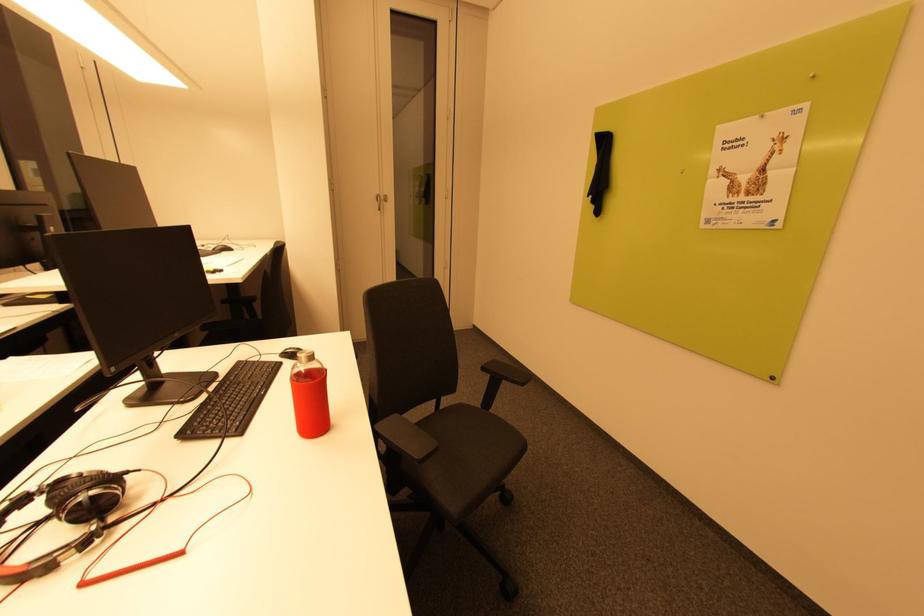
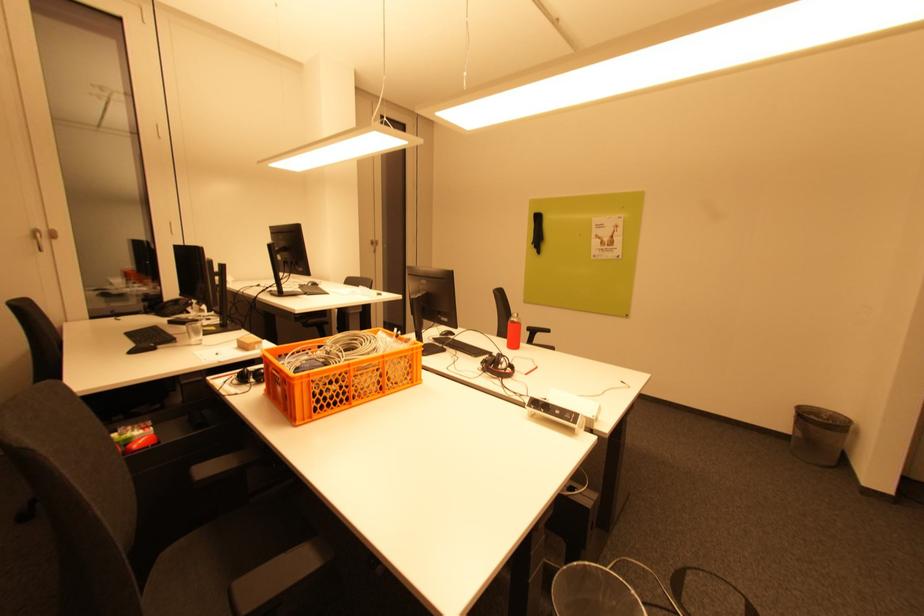
Which direction would the cameraman need to move to produce the second image?

The movement direction of the cameraman is left, backward.